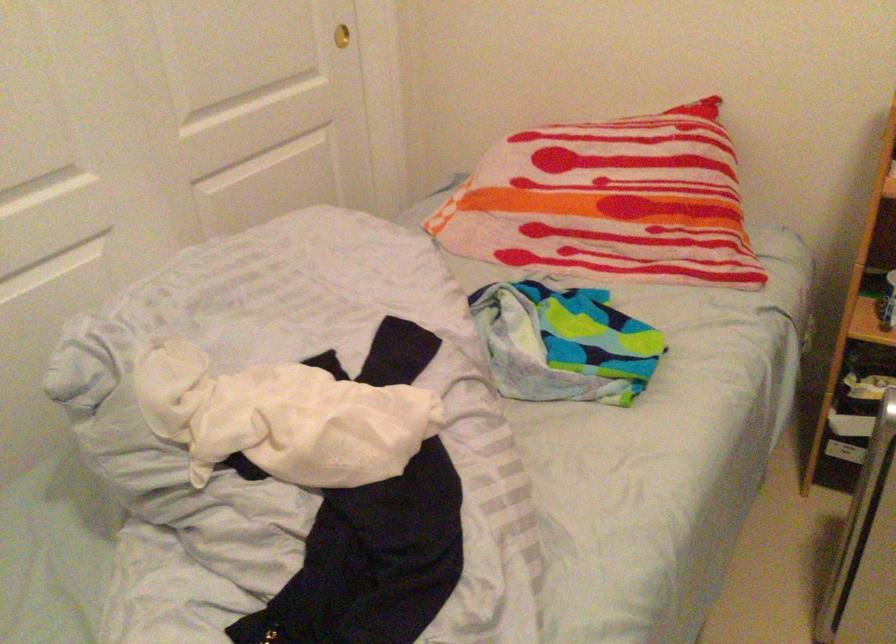
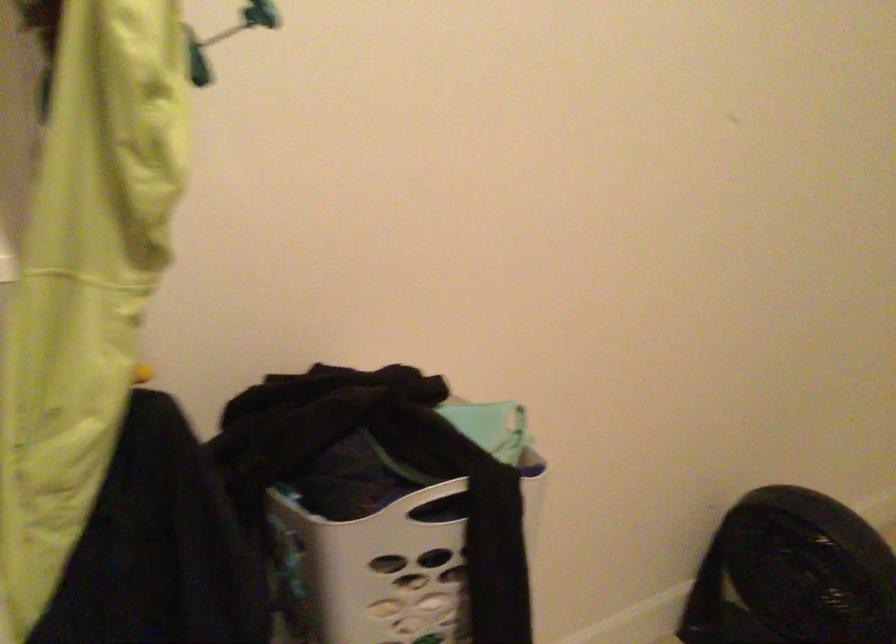
Based on the continuous images, in which direction is the camera rotating?

The rotation direction of the camera is left-down.